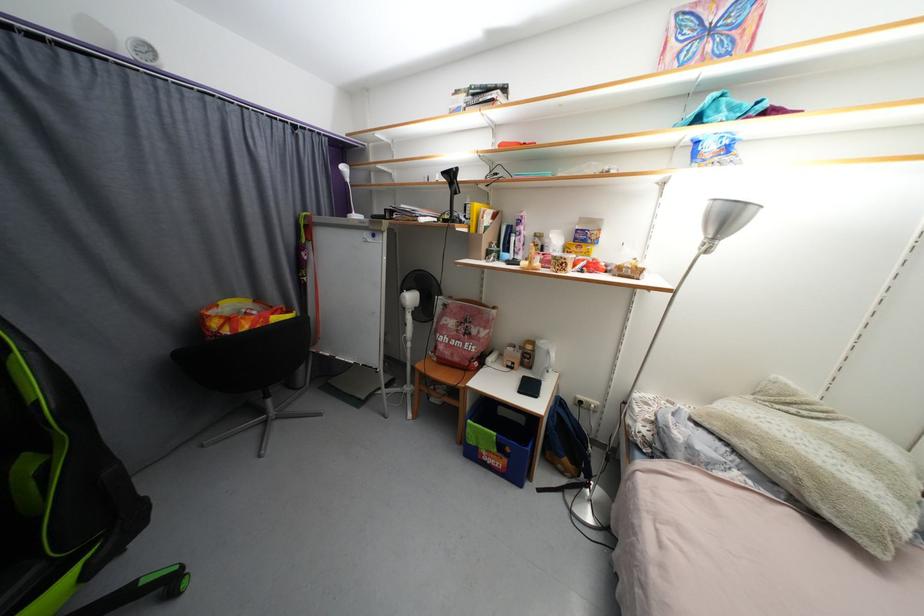
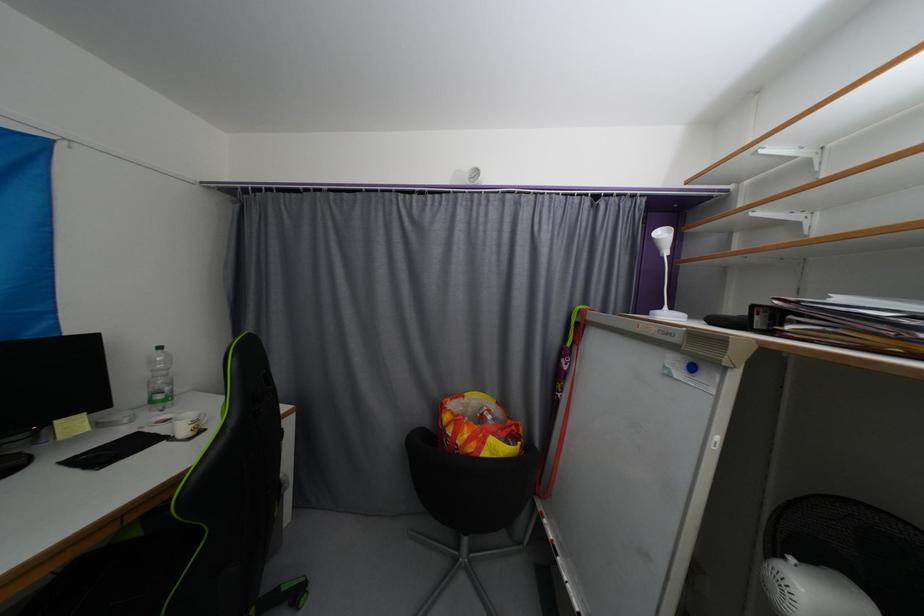
Question: The first image is from the beginning of the video and the second image is from the end. How did the camera likely rotate when shooting the video?

Choices:
 (A) Left
 (B) Right
 (C) Up
 (D) Down

Answer: (A)